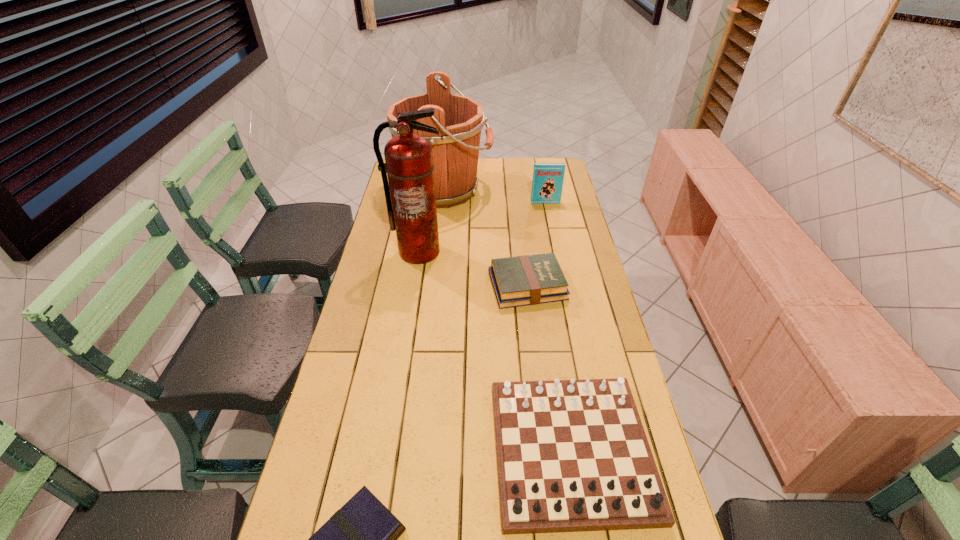
Where is `the tallest object`? The height and width of the screenshot is (540, 960). the tallest object is located at coordinates (411, 201).

I want to click on the second tallest object, so click(459, 120).

The width and height of the screenshot is (960, 540). What are the coordinates of `the tallest book` in the screenshot? It's located at (547, 184).

Locate an element on the screen. Image resolution: width=960 pixels, height=540 pixels. the farthest book is located at coordinates (547, 184).

You are a GUI agent. You are given a task and a screenshot of the screen. Output one action in this format:
    pyautogui.click(x=<x>, y=<y>)
    Task: Click on the fourth tallest object
    This screenshot has height=540, width=960.
    Given the screenshot: What is the action you would take?
    pos(572,455)

Image resolution: width=960 pixels, height=540 pixels. I want to click on the fifth tallest object, so click(524, 280).

The height and width of the screenshot is (540, 960). I want to click on the second shortest book, so click(x=524, y=280).

Where is `blank space located 0.340m on the side of the fire extinguisher with the handle and hose`? This screenshot has width=960, height=540. blank space located 0.340m on the side of the fire extinguisher with the handle and hose is located at coordinates (404, 339).

Where is `vacant space located 0.150m with the handle on the side of the bucket`? Image resolution: width=960 pixels, height=540 pixels. vacant space located 0.150m with the handle on the side of the bucket is located at coordinates (526, 190).

The image size is (960, 540). What are the coordinates of `vacant region located 0.130m on the front cover of the fourth shortest object` in the screenshot? It's located at (549, 221).